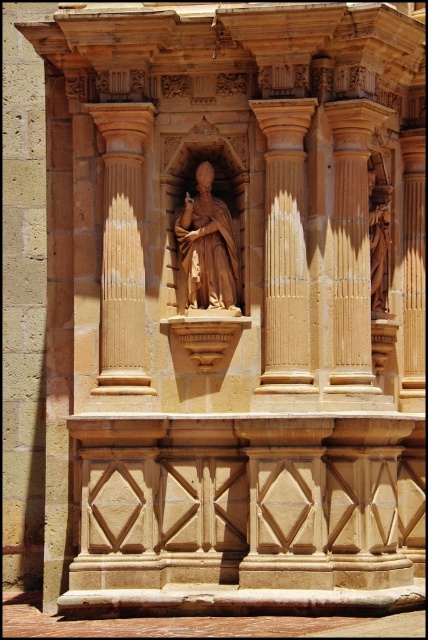
Describe the element at coordinates (285, 246) in the screenshot. This screenshot has width=428, height=640. I see `sandy stone column at center` at that location.

Between sandy stone column at center and matte brown statue at center, which one has more height?

matte brown statue at center

Describe the element at coordinates (285, 246) in the screenshot. I see `sandy stone column at center` at that location.

Identify the location of sandy stone column at center. This screenshot has width=428, height=640. (285, 246).

Which is more to the left, smooth stone column at right or matte brown statue at center?

matte brown statue at center is more to the left.

Between smooth stone column at right and matte brown statue at center, which one appears on the right side from the viewer's perspective?

From the viewer's perspective, smooth stone column at right appears more on the right side.

What do you see at coordinates (351, 243) in the screenshot? I see `smooth stone column at right` at bounding box center [351, 243].

Where is `smooth stone column at right`? Image resolution: width=428 pixels, height=640 pixels. smooth stone column at right is located at coordinates (351, 243).

Is point (112, 266) positioned before point (187, 307)?

Yes, point (112, 266) is closer to viewer.

The image size is (428, 640). What do you see at coordinates (122, 248) in the screenshot? I see `sandy beige stone column at left` at bounding box center [122, 248].

Which is behind, point (121, 292) or point (211, 237)?

Positioned behind is point (211, 237).

What are the coordinates of `sandy beige stone column at left` in the screenshot? It's located at (122, 248).